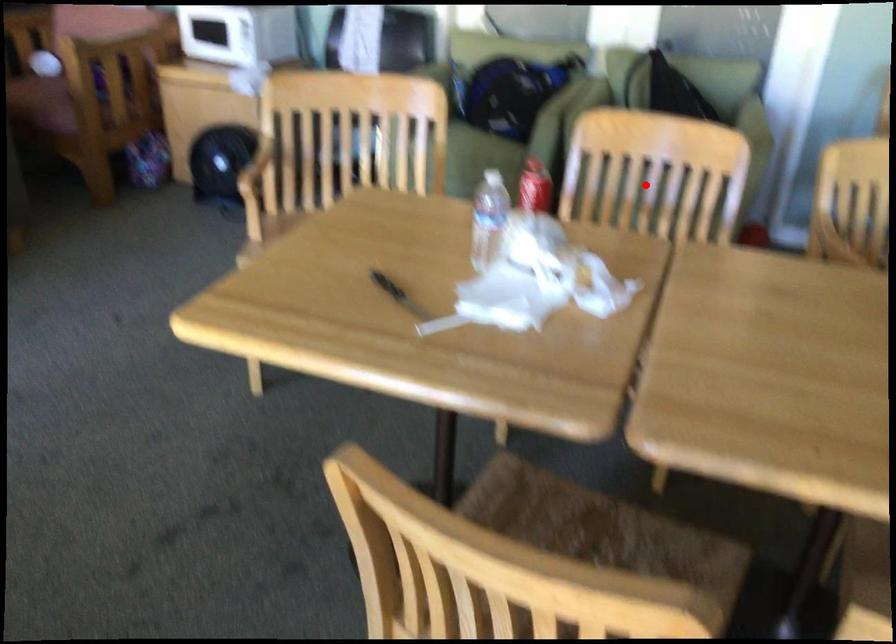
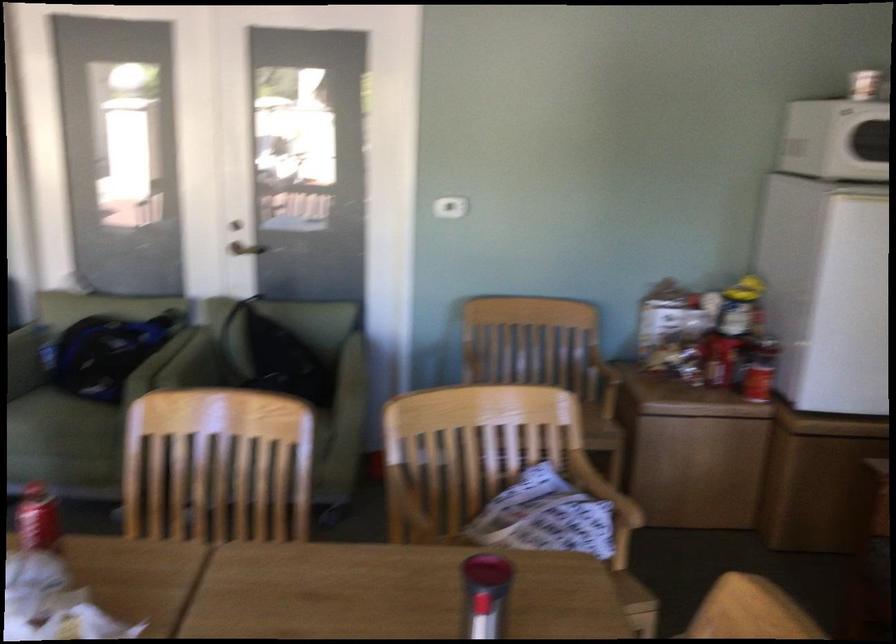
Locate, in the second image, the point that corresponds to the highlighted location in the first image.

(217, 466)